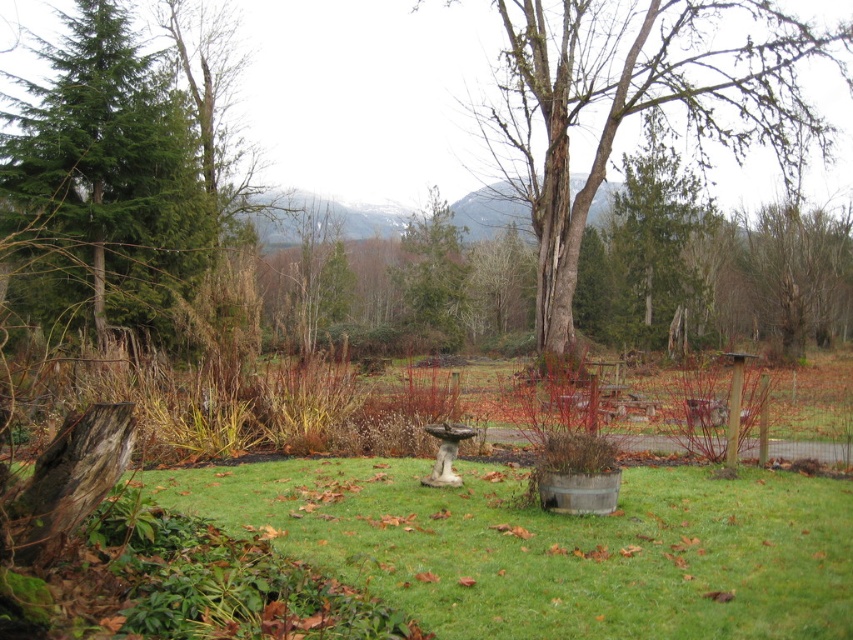
Question: Observing the image, what is the correct spatial positioning of green rough bark tree at center in reference to green textured evergreen tree at center?

Choices:
 (A) right
 (B) left

Answer: (A)

Question: Which point is closer to the camera?

Choices:
 (A) (567, 131)
 (B) (410, 256)
 (C) (669, 342)

Answer: (A)

Question: Does green coniferous tree at left come behind green textured evergreen tree at center?

Choices:
 (A) yes
 (B) no

Answer: (B)

Question: Among these objects, which one is farthest from the camera?

Choices:
 (A) green coniferous tree at left
 (B) green rough bark tree at center
 (C) green textured evergreen tree at center
 (D) bark textured tree at center

Answer: (C)

Question: Is bark textured tree at center wider than green rough bark tree at center?

Choices:
 (A) no
 (B) yes

Answer: (B)

Question: Which point appears farthest from the camera in this image?

Choices:
 (A) (454, 260)
 (B) (682, 109)
 (C) (706, 310)

Answer: (B)